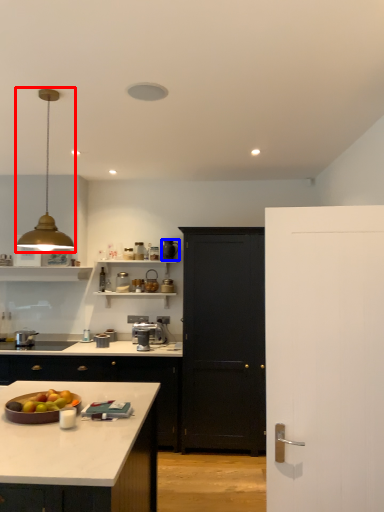
Question: Which object appears closest to the camera in this image, light fixture (highlighted by a red box) or appliance (highlighted by a blue box)?

Choices:
 (A) light fixture
 (B) appliance

Answer: (A)